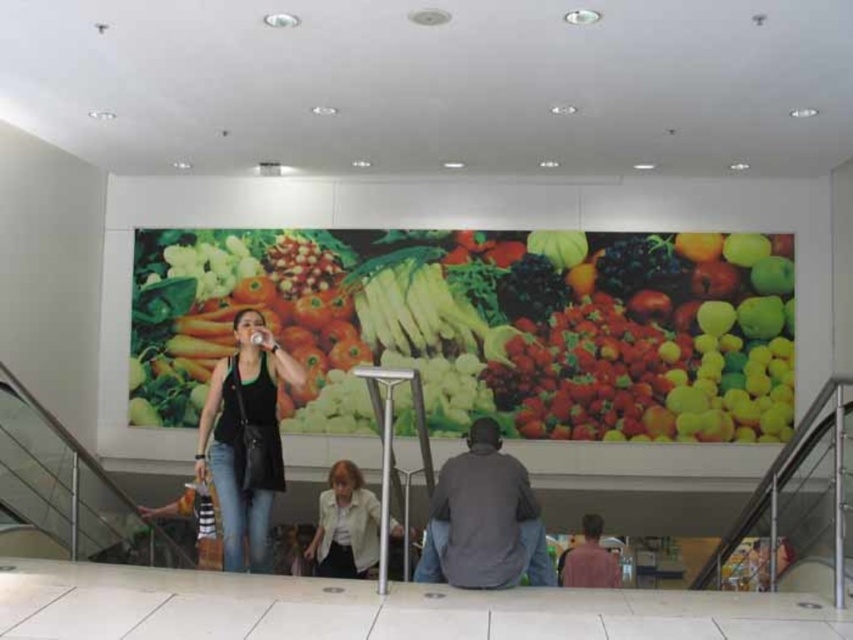
What do you see at coordinates (245, 440) in the screenshot? This screenshot has width=853, height=640. I see `black matte tank top at center` at bounding box center [245, 440].

Consider the image. Can you confirm if black matte tank top at center is positioned above matte pink shirt at lower right?

Correct, black matte tank top at center is located above matte pink shirt at lower right.

Locate an element on the screen. black matte tank top at center is located at coordinates (245, 440).

This screenshot has height=640, width=853. What do you see at coordinates (483, 326) in the screenshot?
I see `vibrant plastic vegetables at center` at bounding box center [483, 326].

Is point (466, 396) positioned before point (357, 518)?

No, (466, 396) is behind (357, 518).

The width and height of the screenshot is (853, 640). Describe the element at coordinates (483, 326) in the screenshot. I see `vibrant plastic vegetables at center` at that location.

Identify the location of vibrant plastic vegetables at center. The height and width of the screenshot is (640, 853). (483, 326).

Which is behind, point (192, 413) or point (231, 355)?

Positioned behind is point (192, 413).

Where is `vibrant plastic vegetables at center`? The width and height of the screenshot is (853, 640). vibrant plastic vegetables at center is located at coordinates (483, 326).

The image size is (853, 640). Find the location of `vibrant plastic vegetables at center`. vibrant plastic vegetables at center is located at coordinates (483, 326).